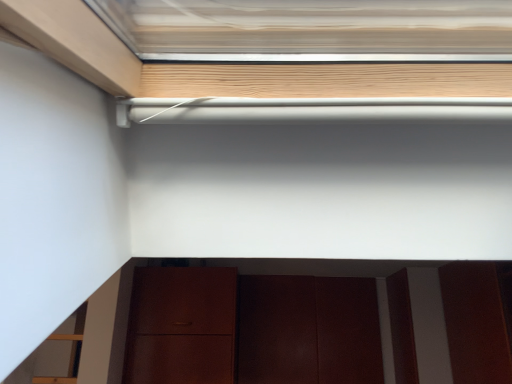
Question: Can you see matte brown cabinet at lower center touching dark wood door at lower center?

Choices:
 (A) yes
 (B) no

Answer: (B)

Question: From a real-world perspective, is matte brown cabinet at lower center on dark wood door at lower center?

Choices:
 (A) no
 (B) yes

Answer: (B)

Question: Can you confirm if matte brown cabinet at lower center is taller than dark wood door at lower center?

Choices:
 (A) yes
 (B) no

Answer: (B)

Question: Is matte brown cabinet at lower center aimed at dark wood door at lower center?

Choices:
 (A) no
 (B) yes

Answer: (A)

Question: From a real-world perspective, is matte brown cabinet at lower center beneath dark wood door at lower center?

Choices:
 (A) yes
 (B) no

Answer: (B)

Question: Is matte brown cabinet at lower center positioned behind dark wood door at lower center?

Choices:
 (A) yes
 (B) no

Answer: (B)

Question: Is dark wood door at lower center positioned in front of matte brown cabinet at lower center?

Choices:
 (A) yes
 (B) no

Answer: (B)

Question: Can you confirm if dark wood door at lower center is shorter than matte brown cabinet at lower center?

Choices:
 (A) no
 (B) yes

Answer: (A)

Question: Is dark wood door at lower center to the left of matte brown cabinet at lower center from the viewer's perspective?

Choices:
 (A) yes
 (B) no

Answer: (A)

Question: From a real-world perspective, is dark wood door at lower center positioned over matte brown cabinet at lower center based on gravity?

Choices:
 (A) no
 (B) yes

Answer: (A)

Question: Are dark wood door at lower center and matte brown cabinet at lower center beside each other?

Choices:
 (A) no
 (B) yes

Answer: (A)

Question: Is dark wood door at lower center taller than matte brown cabinet at lower center?

Choices:
 (A) no
 (B) yes

Answer: (B)

Question: In the image, is dark wood door at lower center on the left side or the right side of matte brown cabinet at lower center?

Choices:
 (A) left
 (B) right

Answer: (A)